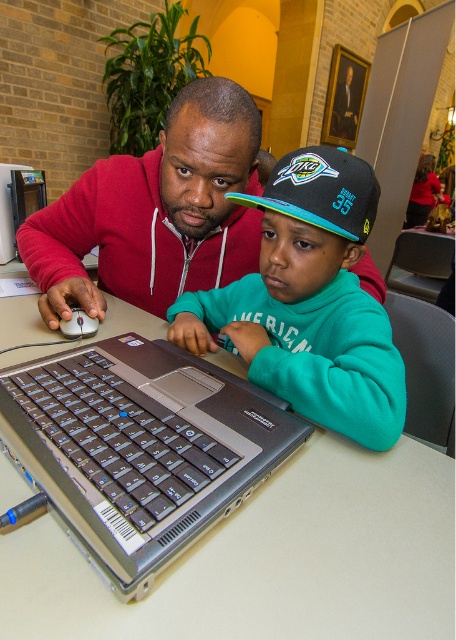
Question: Does silver metallic laptop at center have a greater width compared to teal matte sweatshirt at center?

Choices:
 (A) yes
 (B) no

Answer: (A)

Question: Which point appears closest to the camera in this image?

Choices:
 (A) (200, 248)
 (B) (324, 212)

Answer: (B)

Question: Does silver metallic laptop at center have a smaller size compared to teal matte sweatshirt at center?

Choices:
 (A) yes
 (B) no

Answer: (A)

Question: Which of these objects is positioned farthest from the blue and teal fabric baseball cap at center?

Choices:
 (A) teal matte sweatshirt at center
 (B) matte black mouse at left
 (C) matte red hoodie at center
 (D) silver metallic laptop at center

Answer: (B)

Question: Does blue and teal fabric baseball cap at center appear over matte black mouse at left?

Choices:
 (A) no
 (B) yes

Answer: (B)

Question: Which object is positioned farthest from the teal matte sweatshirt at center?

Choices:
 (A) silver metallic laptop at center
 (B) blue and teal fabric baseball cap at center

Answer: (A)